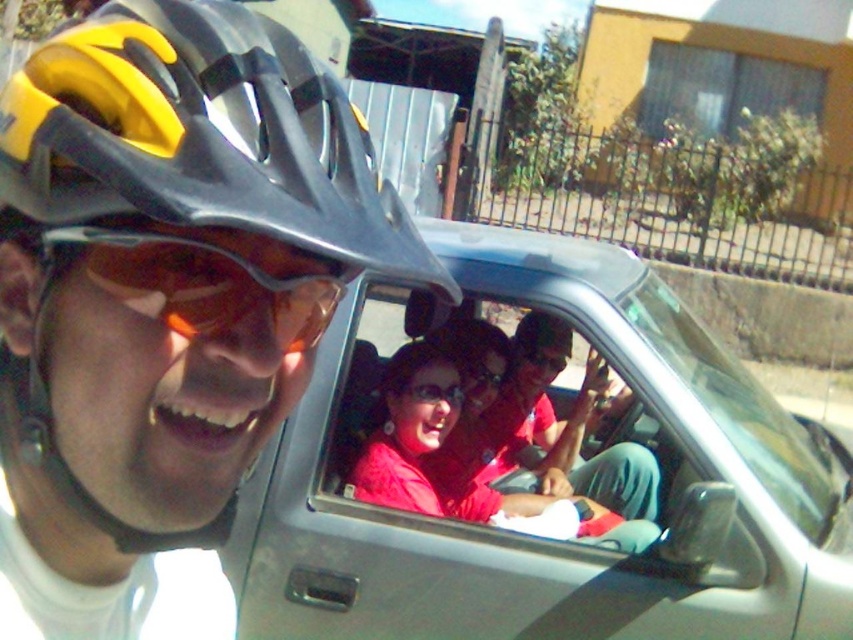
Question: In this image, where is silver metallic car at center located relative to matte black helmet at left?

Choices:
 (A) below
 (B) above

Answer: (A)

Question: Is silver metallic car at center below matte black goggles at center?

Choices:
 (A) no
 (B) yes

Answer: (B)

Question: Is silver metallic car at center bigger than matte black goggles at center?

Choices:
 (A) yes
 (B) no

Answer: (A)

Question: Among these points, which one is farthest from the camera?

Choices:
 (A) (486, 595)
 (B) (212, 296)

Answer: (A)

Question: Which object appears closest to the camera in this image?

Choices:
 (A) silver metallic car at center
 (B) matte black helmet at left
 (C) matte black goggles at center

Answer: (B)

Question: Which is nearer to the matte black goggles at center?

Choices:
 (A) silver metallic car at center
 (B) matte black helmet at left

Answer: (B)